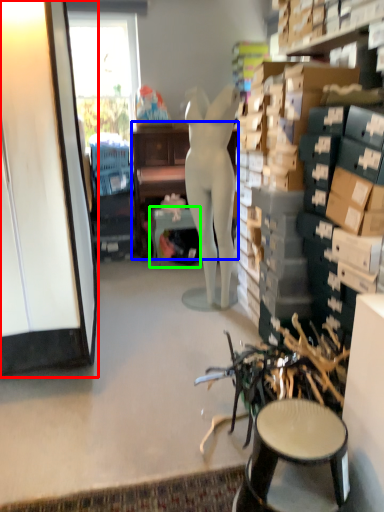
Question: Which object is positioned farthest from cabinetry (highlighted by a red box)? Select from desk (highlighted by a blue box) and table (highlighted by a green box).

Choices:
 (A) desk
 (B) table

Answer: (A)